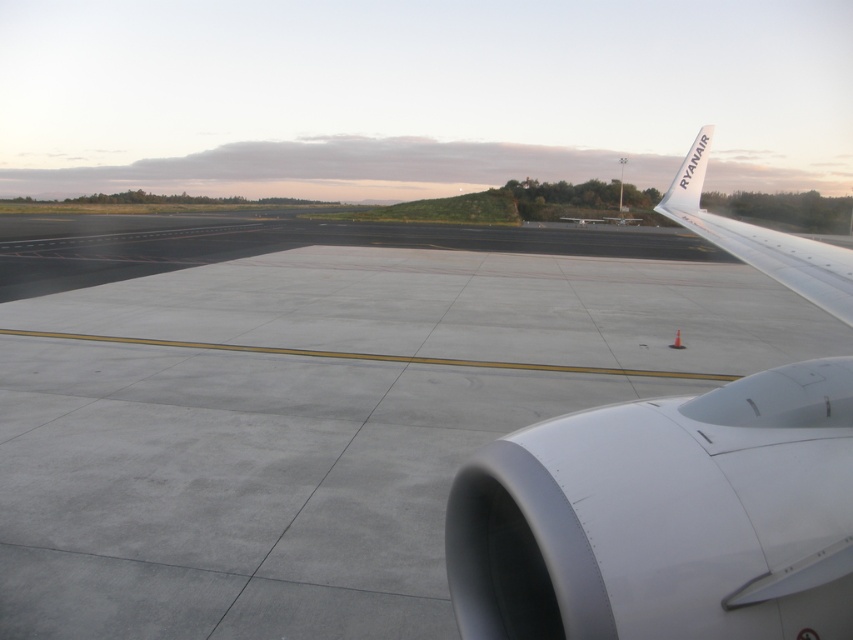
You are an airport maintenance worker who needs to inspect both the white matte airplane wing at upper right and the white metallic wing at upper right. Which wing should you start with if you want to check the smaller one first?

The white matte airplane wing at upper right has a smaller size compared to the white metallic wing at upper right, so you should start with the white matte airplane wing at upper right first.

You are a ground crew member tasked with directing an aircraft to a parking spot. The white matte airplane wing at upper right is currently positioned at coordinates 0.809, 0.780. Is the wing within the designated tarmac area marked by the yellow lines?

The white matte airplane wing at upper right is located at point (x=664, y=516). Since the tarmac area is marked by yellow lines and the wing is positioned within the coordinates specified, it is likely within the designated area for aircraft movement.